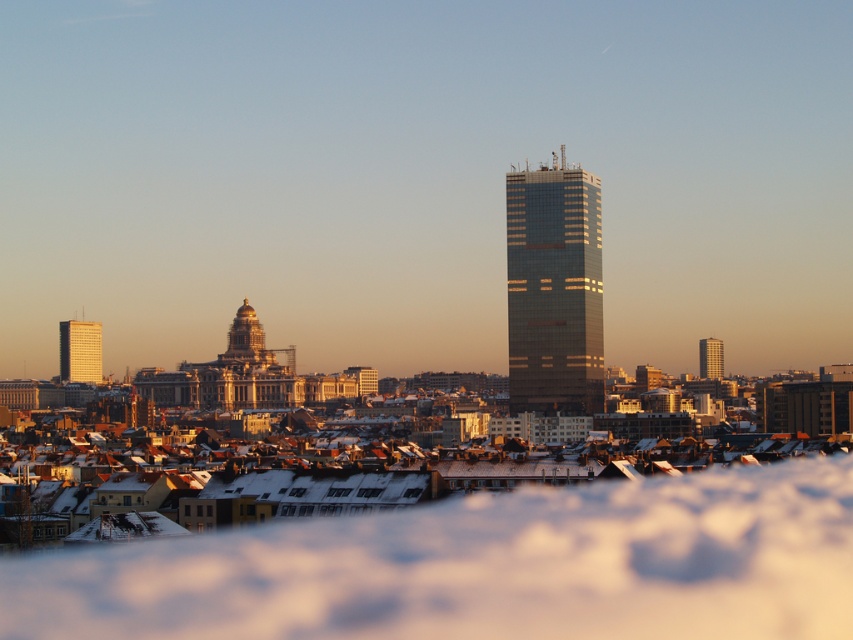
You are a city planner reviewing this area. You need to determine which structure is wider between the gold dome at center and the metallic glass tower at right. Which one is wider?

The gold dome at center is wider than the metallic glass tower at right according to the description.

You are standing at the point with coordinates (x=554, y=289) in the cityscape. What structure do you see immediately around you?

The structure immediately around you at point (x=554, y=289) is the glassy metallic skyscraper at center.